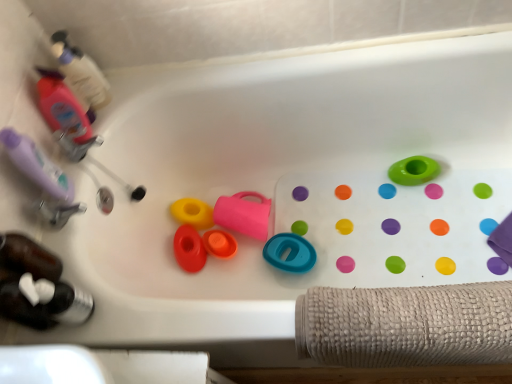
At what (x,y) coordinates should I click in order to perform the action: click on free space in front of green rubber ring at upper right, which ranks as the 1th toy in right-to-left order. Please return your answer as a coordinate pair (x, y). The height and width of the screenshot is (384, 512). Looking at the image, I should click on (434, 221).